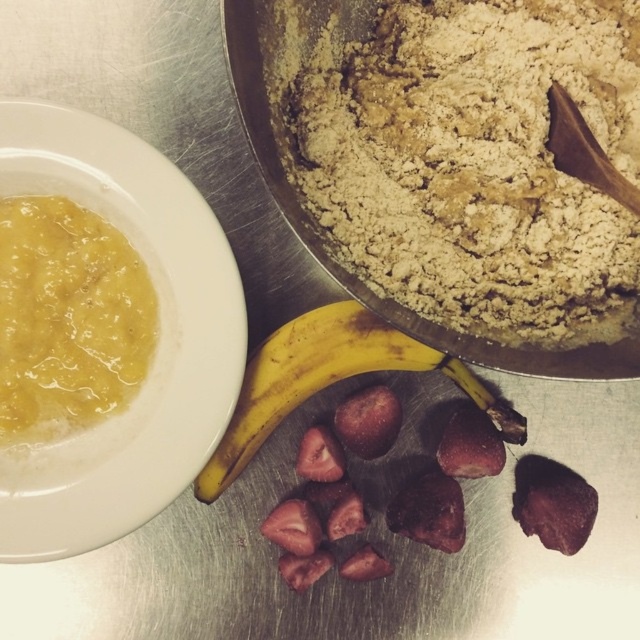
Question: From the image, what is the correct spatial relationship of matte white bowl at upper left in relation to yellow smoothie at left?

Choices:
 (A) above
 (B) below

Answer: (B)

Question: Does dark brown textured strawberry at lower center appear on the right side of wooden spoon at upper right?

Choices:
 (A) yes
 (B) no

Answer: (B)

Question: Which point appears closest to the camera in this image?

Choices:
 (A) (577, 500)
 (B) (484, 394)
 (C) (340, 42)
 (D) (157, 484)

Answer: (D)

Question: Which object is positioned closest to the matte white bowl at upper left?

Choices:
 (A) dry brown flour at upper right
 (B) yellow smoothie at left
 (C) purple matte strawberry at center

Answer: (B)

Question: Which of the following is the closest to the observer?

Choices:
 (A) (579, 144)
 (B) (566, 545)
 (C) (472, 120)
 (D) (289, 330)

Answer: (A)

Question: Does dry brown flour at upper right have a greater width compared to matte white bowl at upper left?

Choices:
 (A) yes
 (B) no

Answer: (A)